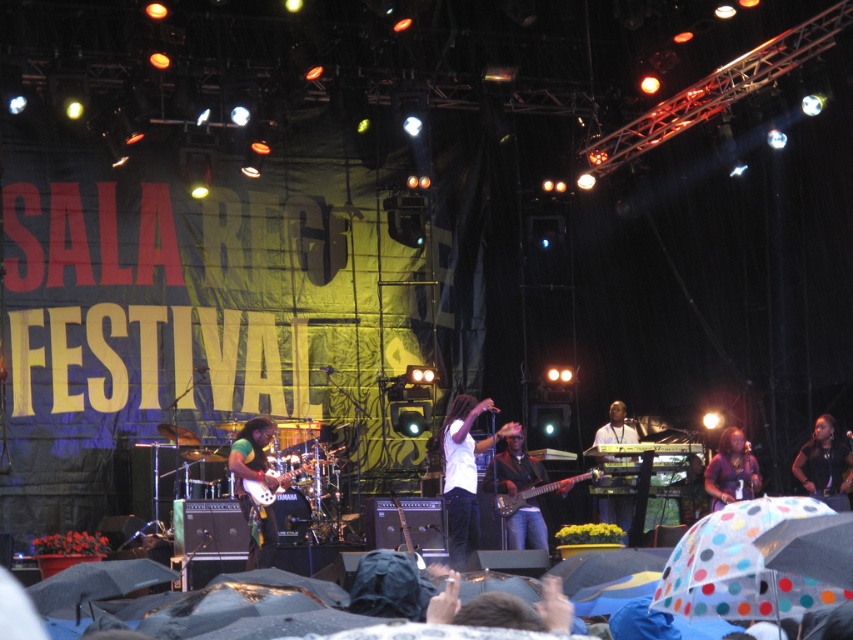
I want to click on white glossy keyboard at center, so click(614, 428).

Who is lower down, white glossy keyboard at center or shiny black electric guitar at center?

Positioned lower is shiny black electric guitar at center.

Between point (618, 512) and point (497, 509), which one is positioned in front?

Point (497, 509) is in front.

Find the location of `white glossy keyboard at center`. white glossy keyboard at center is located at coordinates [x=614, y=428].

Based on the photo, which of these two, green fabric guitar at center or shiny black guitar at center, stands taller?

With more height is green fabric guitar at center.

Can you confirm if green fabric guitar at center is positioned above shiny black guitar at center?

Indeed, green fabric guitar at center is positioned over shiny black guitar at center.

Is point (262, 472) behind point (543, 474)?

No, it is not.

Identify the location of green fabric guitar at center. (256, 480).

Who is more forward, (258, 522) or (746, 464)?

Positioned in front is point (258, 522).

Does point (242, 435) lie behind point (727, 486)?

That is False.

The height and width of the screenshot is (640, 853). I want to click on green fabric guitar at center, so click(x=256, y=480).